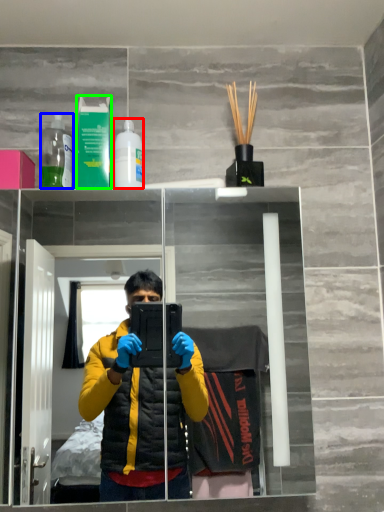
Question: Considering the real-world distances, which object is closest to bottle (highlighted by a red box)? bottle (highlighted by a blue box) or mouthwash (highlighted by a green box).

Choices:
 (A) bottle
 (B) mouthwash

Answer: (B)